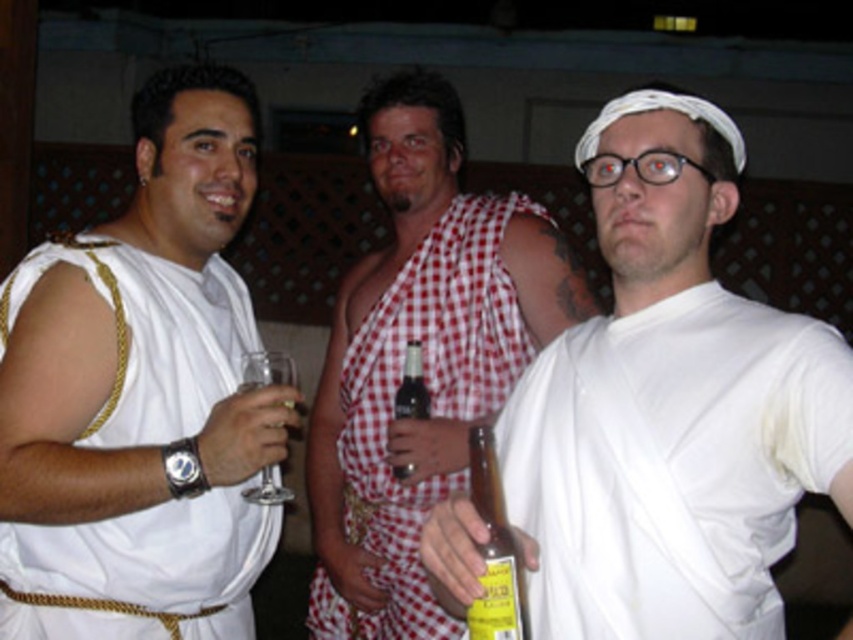
Question: Which of these objects is positioned closest to the white cloth toga at center?

Choices:
 (A) red checkered cloth at center
 (B) white fabric toga at left
 (C) yellow glass bottle at center
 (D) brown glass bottle at center

Answer: (C)

Question: Considering the relative positions of white cloth toga at center and brown glass bottle at center in the image provided, where is white cloth toga at center located with respect to brown glass bottle at center?

Choices:
 (A) right
 (B) left

Answer: (A)

Question: Which of these objects is positioned farthest from the white fabric toga at left?

Choices:
 (A) white cloth toga at center
 (B) red checkered cloth at center
 (C) yellow glass bottle at center
 (D) brown glass bottle at center

Answer: (C)

Question: Is white fabric toga at left bigger than yellow glass bottle at center?

Choices:
 (A) no
 (B) yes

Answer: (B)

Question: Which object is the closest to the yellow glass bottle at center?

Choices:
 (A) white fabric toga at left
 (B) brown glass bottle at center
 (C) white cloth toga at center

Answer: (C)

Question: Does white fabric toga at left appear on the right side of yellow glass bottle at center?

Choices:
 (A) yes
 (B) no

Answer: (B)